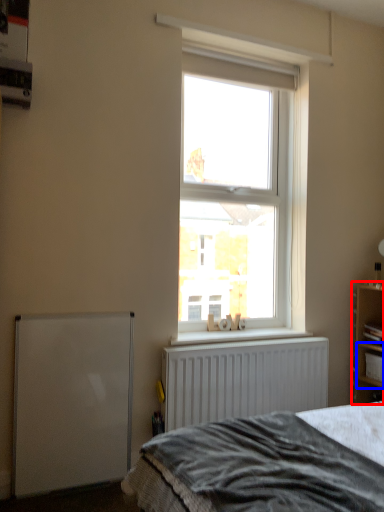
Question: Among these objects, which one is farthest to the camera, shelf (highlighted by a red box) or cabinet (highlighted by a blue box)?

Choices:
 (A) shelf
 (B) cabinet

Answer: (B)